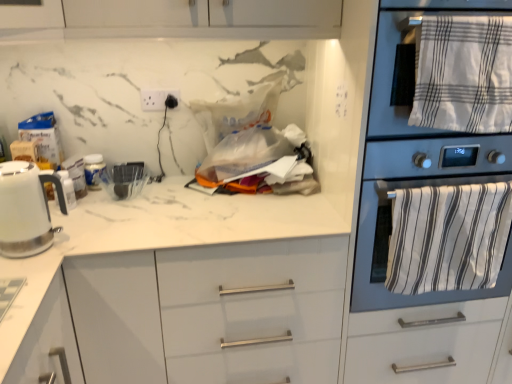
Question: In terms of height, does white glossy electric kettle at left look taller or shorter compared to white striped towel at upper right, the 1th bath towel viewed from the top?

Choices:
 (A) short
 (B) tall

Answer: (A)

Question: Relative to white striped towel at upper right, placed as the 2th bath towel when sorted from bottom to top, is white glossy electric kettle at left in front or behind?

Choices:
 (A) front
 (B) behind

Answer: (A)

Question: Which object is the farthest from the white striped towel at upper right, the 1th bath towel viewed from the top?

Choices:
 (A) white marble countertop at center
 (B) white glossy electric kettle at left
 (C) white plastic electric outlet at upper center
 (D) metallic oven at right
 (E) white striped towel at right, which is counted as the first bath towel, starting from the bottom

Answer: (B)

Question: Considering the real-world distances, which object is closest to the white glossy electric kettle at left?

Choices:
 (A) white striped towel at upper right, the 1th bath towel viewed from the top
 (B) white striped towel at right, which appears as the 2th bath towel when viewed from the top
 (C) white marble countertop at center
 (D) metallic oven at right
 (E) white plastic electric outlet at upper center

Answer: (C)